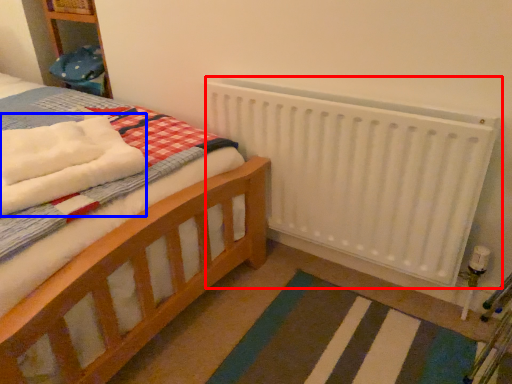
Question: Which point is closer to the camera, radiator (highlighted by a red box) or bath towel (highlighted by a blue box)?

Choices:
 (A) radiator
 (B) bath towel

Answer: (B)